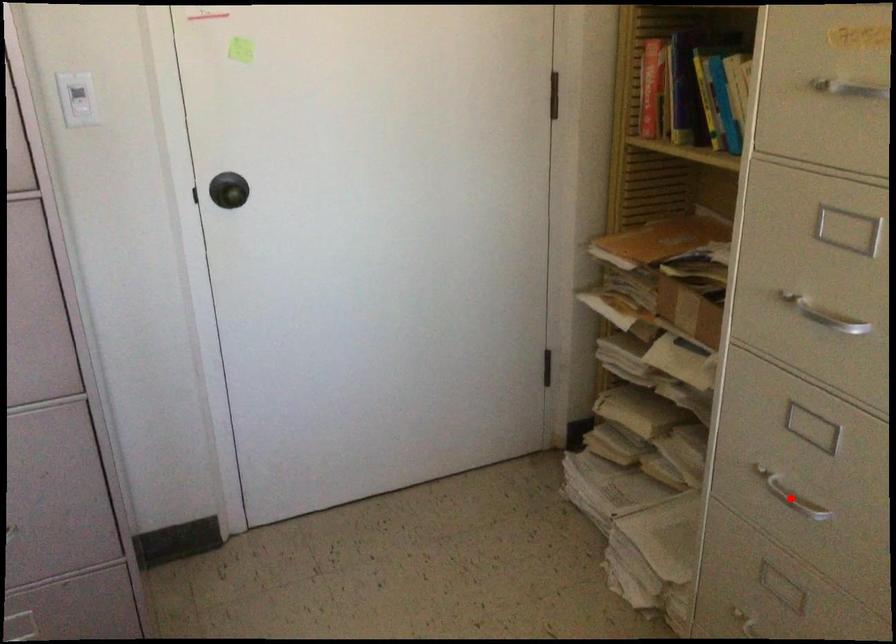
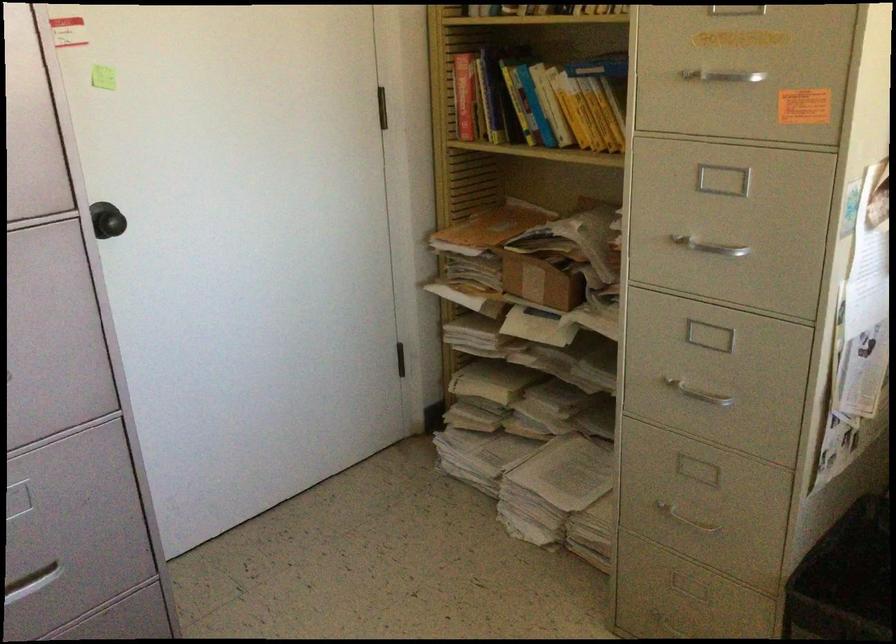
The point at the highlighted location is marked in the first image. Where is the corresponding point in the second image?

(699, 391)